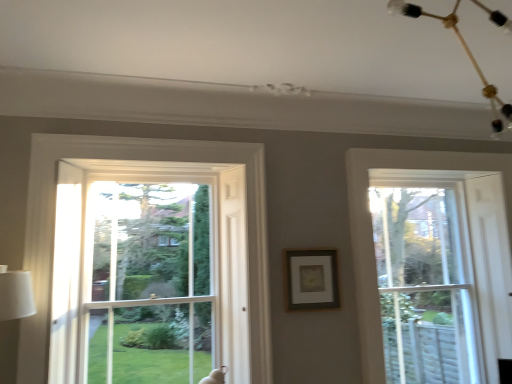
Question: Can you confirm if clear glass window screen at center is positioned to the right of clear glass window at right?

Choices:
 (A) no
 (B) yes

Answer: (A)

Question: Is clear glass window screen at center thinner than clear glass window at right?

Choices:
 (A) no
 (B) yes

Answer: (A)

Question: Can clear glass window at right be found inside clear glass window screen at center?

Choices:
 (A) yes
 (B) no

Answer: (B)

Question: Does clear glass window screen at center have a greater width compared to clear glass window at right?

Choices:
 (A) no
 (B) yes

Answer: (B)

Question: Is clear glass window screen at center shorter than clear glass window at right?

Choices:
 (A) yes
 (B) no

Answer: (A)

Question: Is clear glass window screen at center facing towards clear glass window at right?

Choices:
 (A) yes
 (B) no

Answer: (B)

Question: Can you confirm if matte gold picture frame at center is taller than clear glass window at right?

Choices:
 (A) no
 (B) yes

Answer: (A)

Question: From a real-world perspective, is matte gold picture frame at center located beneath clear glass window at right?

Choices:
 (A) yes
 (B) no

Answer: (B)

Question: Can you confirm if matte gold picture frame at center is smaller than clear glass window at right?

Choices:
 (A) yes
 (B) no

Answer: (A)

Question: Is matte gold picture frame at center positioned in front of clear glass window at right?

Choices:
 (A) no
 (B) yes

Answer: (B)

Question: Is matte gold picture frame at center oriented towards clear glass window at right?

Choices:
 (A) yes
 (B) no

Answer: (B)

Question: Considering the relative sizes of matte gold picture frame at center and clear glass window at right in the image provided, is matte gold picture frame at center shorter than clear glass window at right?

Choices:
 (A) no
 (B) yes

Answer: (B)

Question: Considering the relative sizes of matte gold picture frame at center and clear glass window screen at center in the image provided, is matte gold picture frame at center shorter than clear glass window screen at center?

Choices:
 (A) yes
 (B) no

Answer: (A)